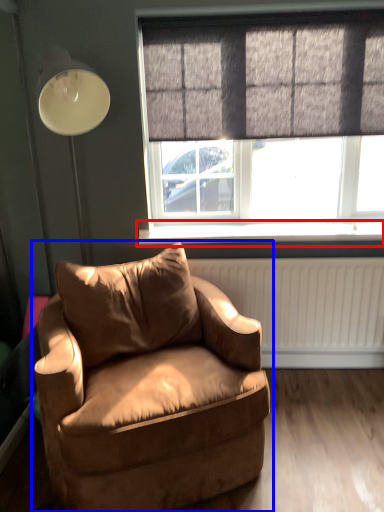
Question: Which of the following is the farthest to the observer, window sill (highlighted by a red box) or chair (highlighted by a blue box)?

Choices:
 (A) window sill
 (B) chair

Answer: (A)